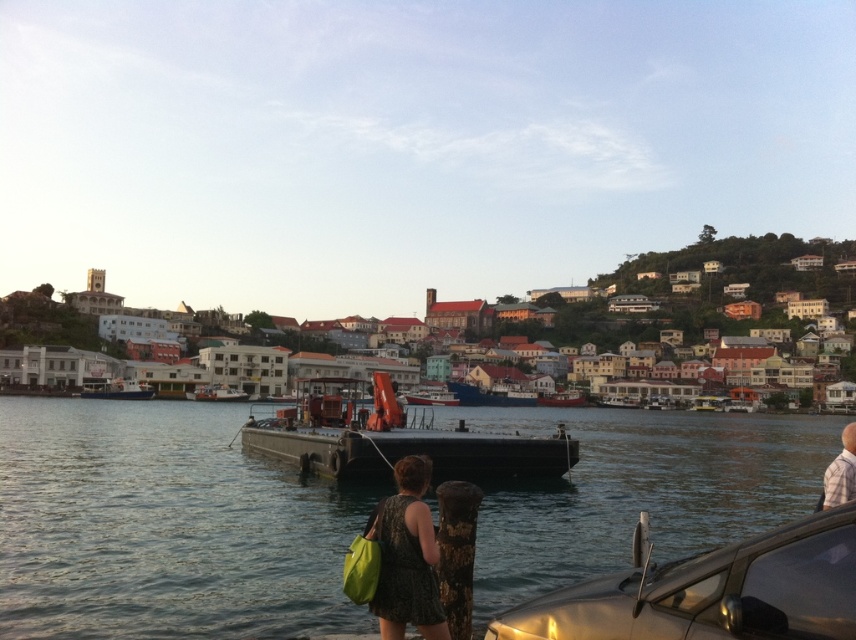
Question: In this image, where is black matte barge at center located relative to metallic gray boat at center?

Choices:
 (A) left
 (B) right

Answer: (B)

Question: Which point is farther from the camera taking this photo?

Choices:
 (A) (408, 401)
 (B) (563, 403)
 (C) (110, 392)

Answer: (B)

Question: Estimate the real-world distances between objects in this image. Which object is farther from the clear water at center?

Choices:
 (A) black matte barge at center
 (B) shiny silver car at lower right
 (C) wooden boat at center
 (D) white shirt at lower right

Answer: (C)

Question: Considering the relative positions of blue matte boat at left and red matte boat at center in the image provided, where is blue matte boat at left located with respect to red matte boat at center?

Choices:
 (A) below
 (B) above

Answer: (B)

Question: In this image, where is shiny silver car at lower right located relative to black matte barge at center?

Choices:
 (A) below
 (B) above

Answer: (A)

Question: Estimate the real-world distances between objects in this image. Which object is farther from the red matte boat at center?

Choices:
 (A) clear water at center
 (B) shiny silver car at lower right

Answer: (B)